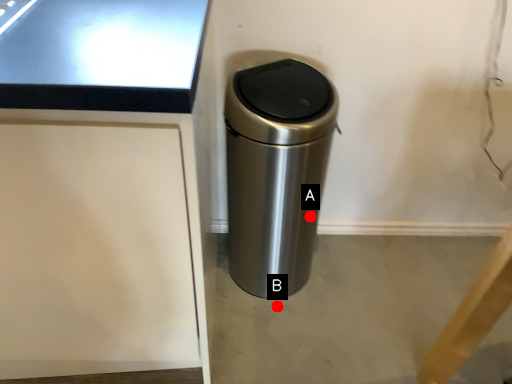
Question: Two points are circled on the image, labeled by A and B beside each circle. Which point is farther from the camera taking this photo?

Choices:
 (A) A is further
 (B) B is further

Answer: (B)